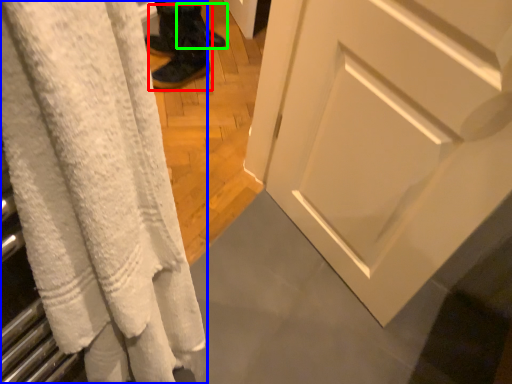
Question: Estimate the real-world distances between objects in this image. Which object is farther from footwear (highlighted by a red box), curtain (highlighted by a blue box) or footwear (highlighted by a green box)?

Choices:
 (A) curtain
 (B) footwear

Answer: (A)